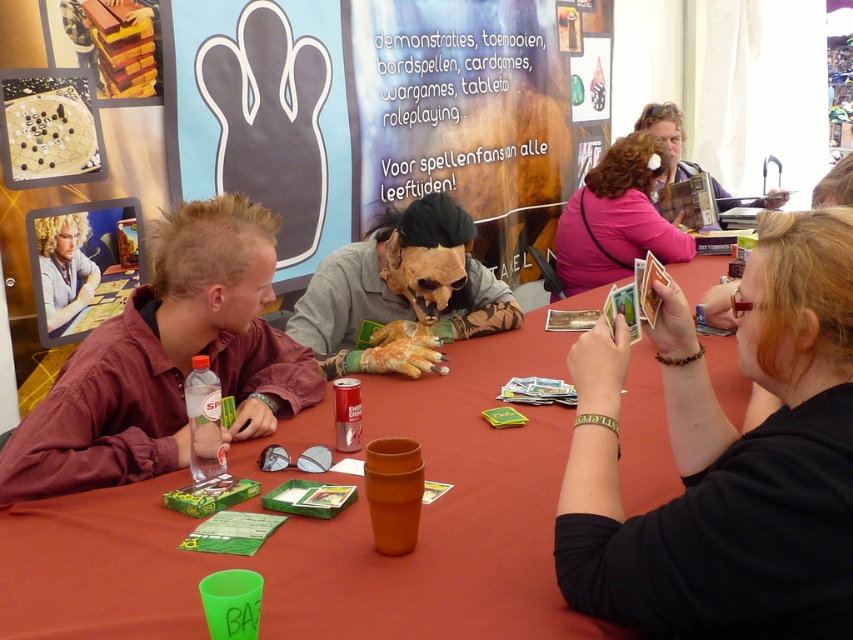
You are organizing a photo shoot at the tabletop gaming event and need to position the two items mentioned in the scene. Given that the matte maroon shirt at lower left and the smooth gray mask at center are both part of the setup, which one requires more space to accommodate in the frame?

The smooth gray mask at center requires more space because the matte maroon shirt at lower left occupies less space than it.

You are a game organizer at the convention and need to place a new rulebook on the table. The rulebook must be placed above the matte maroon shirt at lower left but not overlapping the smooth plastic cup at center. Is this possible given their positions?

The smooth plastic cup at center is located below the matte maroon shirt at lower left, so placing the rulebook above the matte maroon shirt at lower left would naturally avoid overlapping the cup since the cup is already below the shirt. Therefore, it is possible to place the rulebook there without overlapping the cup.

Based on the photo, you are standing at the edge of the table looking towards the center. There is a point marked at coordinates (167, 362). Which object from the list is located at that point? Choose from the options provided in the objects list.

The point at (167, 362) indicates the location of the matte maroon shirt at lower left.